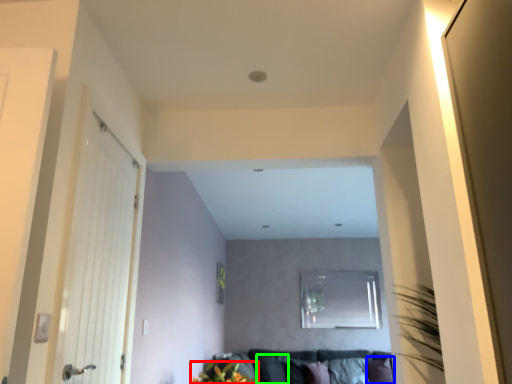
Question: Based on their relative distances, which object is farther from floral arrangement (highlighted by a red box)? Choose from pillow (highlighted by a blue box) and pillow (highlighted by a green box).

Choices:
 (A) pillow
 (B) pillow

Answer: (A)